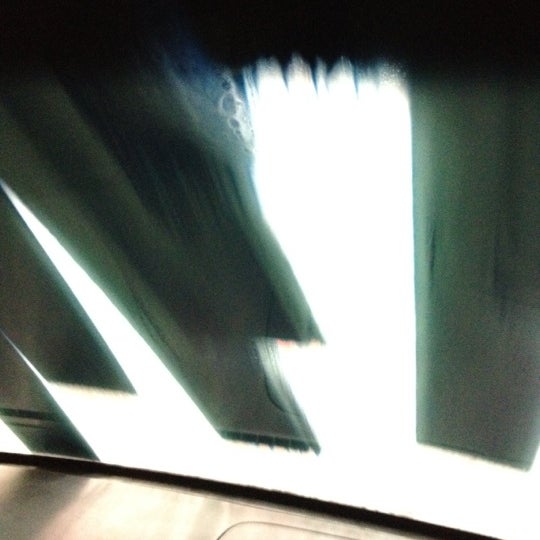
Where is `floor groove`? This screenshot has height=540, width=540. floor groove is located at coordinates (222, 536).